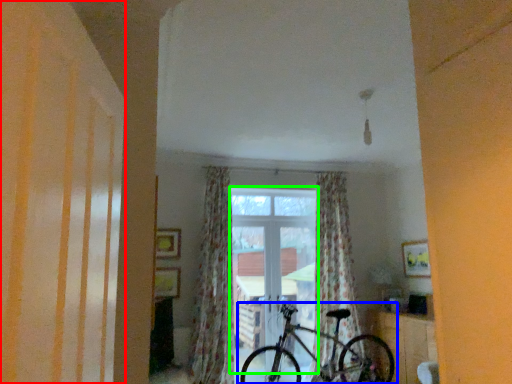
Question: Considering the real-world distances, which object is farthest from shutter (highlighted by a red box)? bicycle (highlighted by a blue box) or window (highlighted by a green box)?

Choices:
 (A) bicycle
 (B) window

Answer: (B)